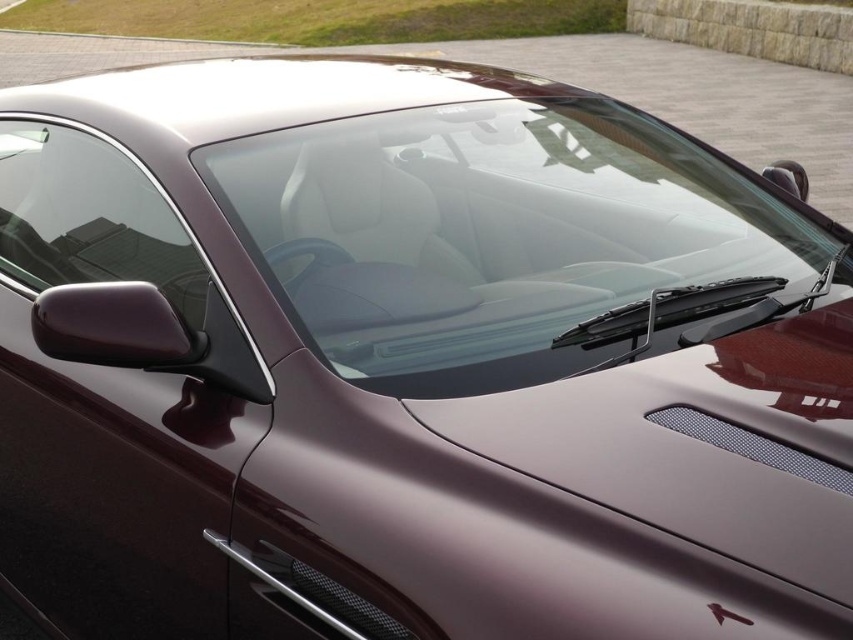
Which of these two, transparent glass windshield at center or transparent glass windshield at upper left, stands shorter?

With less height is transparent glass windshield at upper left.

Does point (608, 232) come farther from viewer compared to point (28, 237)?

No, (608, 232) is in front of (28, 237).

Where is `transparent glass windshield at center`? transparent glass windshield at center is located at coordinates (492, 232).

Does glossy brown car at upper center have a lesser height compared to transparent glass windshield at upper left?

No, glossy brown car at upper center is not shorter than transparent glass windshield at upper left.

Between glossy brown car at upper center and transparent glass windshield at upper left, which one is positioned lower?

Positioned lower is transparent glass windshield at upper left.

What do you see at coordinates (576, 84) in the screenshot? I see `glossy brown car at upper center` at bounding box center [576, 84].

Where is `glossy brown car at upper center`? The width and height of the screenshot is (853, 640). glossy brown car at upper center is located at coordinates (576, 84).

Between transparent glass windshield at center and glossy brown car at upper center, which one has more height?

With more height is glossy brown car at upper center.

Who is positioned more to the left, transparent glass windshield at center or glossy brown car at upper center?

glossy brown car at upper center is more to the left.

Between point (524, 168) and point (325, 49), which one is positioned behind?

Positioned behind is point (325, 49).

Locate an element on the screen. transparent glass windshield at center is located at coordinates (492, 232).